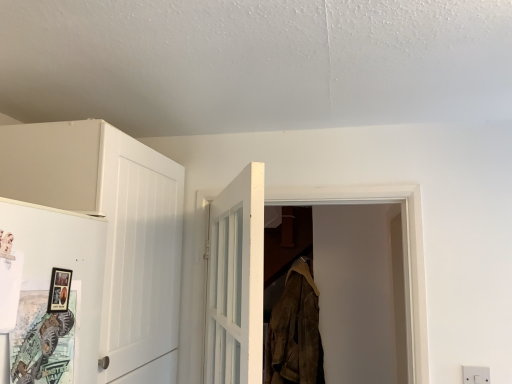
What do you see at coordinates (295, 331) in the screenshot? The width and height of the screenshot is (512, 384). I see `brown suede jacket at center` at bounding box center [295, 331].

What do you see at coordinates (476, 375) in the screenshot?
I see `white plastic electric outlet at lower right` at bounding box center [476, 375].

Find the location of `brown suede jacket at center`. brown suede jacket at center is located at coordinates (295, 331).

From the picture: Looking at their sizes, would you say white plastic electric outlet at lower right is wider or thinner than white wooden door at center, arranged as the 2th door when viewed from the front?

In the image, white plastic electric outlet at lower right appears to be more narrow than white wooden door at center, arranged as the 2th door when viewed from the front.

Which is less distant, (476, 380) or (230, 339)?

Positioned in front is point (230, 339).

Considering the relative sizes of white plastic electric outlet at lower right and white wooden door at center, arranged as the 2th door when viewed from the front, in the image provided, is white plastic electric outlet at lower right taller than white wooden door at center, arranged as the 2th door when viewed from the front,?

No.

From a real-world perspective, which object stands above the other?

matte white door at left, the 2th door when ordered from back to front.

From the image's perspective, is brown suede jacket at center positioned above or below matte white door at left, the second door in the right-to-left sequence?

brown suede jacket at center is below matte white door at left, the second door in the right-to-left sequence.

Considering the positions of objects brown suede jacket at center and matte white door at left, the 2th door when ordered from back to front, in the image provided, who is more to the left, brown suede jacket at center or matte white door at left, the 2th door when ordered from back to front,?

A: Positioned to the left is matte white door at left, the 2th door when ordered from back to front.

Where is `the 1st door directly above the brown suede jacket at center (from a real-world perspective)`? This screenshot has height=384, width=512. the 1st door directly above the brown suede jacket at center (from a real-world perspective) is located at coordinates (64, 262).

Considering the relative positions of white wooden door at center, positioned as the first door in back-to-front order, and white plastic electric outlet at lower right in the image provided, is white wooden door at center, positioned as the first door in back-to-front order, to the right of white plastic electric outlet at lower right from the viewer's perspective?

In fact, white wooden door at center, positioned as the first door in back-to-front order, is to the left of white plastic electric outlet at lower right.

From the image's perspective, between white wooden door at center, the second door when ordered from left to right, and white plastic electric outlet at lower right, who is located below?

From the image's view, white plastic electric outlet at lower right is below.

From a real-world perspective, is white wooden door at center, the 1th door from the right, on top of white plastic electric outlet at lower right?

Correct, in the physical world, white wooden door at center, the 1th door from the right, is higher than white plastic electric outlet at lower right.

Looking at their sizes, would you say white wooden door at center, positioned as the first door in back-to-front order, is wider or thinner than white plastic electric outlet at lower right?

Considering their sizes, white wooden door at center, positioned as the first door in back-to-front order, looks broader than white plastic electric outlet at lower right.

Is white matte cabinet at left further to the viewer compared to matte black picture frame at left?

Yes, white matte cabinet at left is further from the camera.

Is matte black picture frame at left inside white matte cabinet at left?

That's incorrect, matte black picture frame at left is not inside white matte cabinet at left.

Who is taller, white matte cabinet at left or matte black picture frame at left?

white matte cabinet at left.

How different are the orientations of white matte cabinet at left and matte black picture frame at left in degrees?

The facing directions of white matte cabinet at left and matte black picture frame at left are 0.0297 degrees apart.

Is matte white door at left, the first door positioned from the left, far from white plastic electric outlet at lower right?

Yes, matte white door at left, the first door positioned from the left, is far from white plastic electric outlet at lower right.

Is matte white door at left, acting as the 1th door starting from the front, aimed at white plastic electric outlet at lower right?

No, matte white door at left, acting as the 1th door starting from the front, is not oriented towards white plastic electric outlet at lower right.

Is white plastic electric outlet at lower right a part of matte white door at left, acting as the 1th door starting from the front?

No, white plastic electric outlet at lower right is not surrounded by matte white door at left, acting as the 1th door starting from the front.

Is matte white door at left, the 2th door when ordered from back to front, shorter than white plastic electric outlet at lower right?

Incorrect, the height of matte white door at left, the 2th door when ordered from back to front, does not fall short of that of white plastic electric outlet at lower right.

Between white plastic electric outlet at lower right and matte black picture frame at left, which one has less height?

With less height is white plastic electric outlet at lower right.

Is matte black picture frame at left a part of white plastic electric outlet at lower right?

Actually, matte black picture frame at left is outside white plastic electric outlet at lower right.

Between white plastic electric outlet at lower right and matte black picture frame at left, which one has smaller size?

Smaller between the two is matte black picture frame at left.

Is the depth of white plastic electric outlet at lower right less than that of matte black picture frame at left?

No, white plastic electric outlet at lower right is further to the viewer.

Is matte black picture frame at left smaller than white wooden door at center, the second door when ordered from left to right?

Yes.

I want to click on picture frame on the left of white wooden door at center, arranged as the 2th door when viewed from the front, so click(x=59, y=290).

Does matte black picture frame at left have a greater width compared to white wooden door at center, positioned as the first door in back-to-front order?

In fact, matte black picture frame at left might be narrower than white wooden door at center, positioned as the first door in back-to-front order.

Which is in front, point (62, 269) or point (231, 320)?

The point (62, 269) is closer to the camera.

The width and height of the screenshot is (512, 384). Identify the location of the 1st door above the white plastic electric outlet at lower right (from the image's perspective). (236, 281).

Locate an element on the screen. Image resolution: width=512 pixels, height=384 pixels. clothing that appears below the matte white door at left, the first door positioned from the left (from a real-world perspective) is located at coordinates (295, 331).

Estimate the real-world distances between objects in this image. Which object is further from matte white door at left, the first door positioned from the left, matte black picture frame at left or brown suede jacket at center?

brown suede jacket at center is positioned further to the anchor matte white door at left, the first door positioned from the left.

When comparing their distances from white matte cabinet at left, does matte white door at left, the second door in the right-to-left sequence, or matte black picture frame at left seem closer?

matte white door at left, the second door in the right-to-left sequence.

Which object lies further to the anchor point white matte cabinet at left, matte white door at left, the second door in the right-to-left sequence, or white plastic electric outlet at lower right?

Based on the image, white plastic electric outlet at lower right appears to be further to white matte cabinet at left.

Which object lies further to the anchor point white wooden door at center, positioned as the first door in back-to-front order, white matte cabinet at left or brown suede jacket at center?

brown suede jacket at center lies further to white wooden door at center, positioned as the first door in back-to-front order, than the other object.

Consider the image. When comparing their distances from matte black picture frame at left, does brown suede jacket at center or matte white door at left, the second door in the right-to-left sequence, seem further?

Based on the image, brown suede jacket at center appears to be further to matte black picture frame at left.

From the image, which object appears to be farther from matte white door at left, acting as the 1th door starting from the front, brown suede jacket at center or white plastic electric outlet at lower right?

brown suede jacket at center is positioned further to the anchor matte white door at left, acting as the 1th door starting from the front.

Based on their spatial positions, is white wooden door at center, the 1th door from the right, or matte black picture frame at left further from white matte cabinet at left?

The object further to white matte cabinet at left is matte black picture frame at left.

Looking at the image, which one is located closer to white plastic electric outlet at lower right, matte black picture frame at left or brown suede jacket at center?

The object closer to white plastic electric outlet at lower right is brown suede jacket at center.

Where is `picture frame between matte white door at left, acting as the 1th door starting from the front, and white matte cabinet at left from front to back`? picture frame between matte white door at left, acting as the 1th door starting from the front, and white matte cabinet at left from front to back is located at coordinates (59, 290).

This screenshot has width=512, height=384. Identify the location of door situated between matte black picture frame at left and white wooden door at center, the second door when ordered from left to right, from left to right. (64, 262).

This screenshot has height=384, width=512. What are the coordinates of `door situated between matte white door at left, the first door positioned from the left, and white plastic electric outlet at lower right from left to right` in the screenshot? It's located at (236, 281).

Where is `picture frame located between white wooden door at center, the second door when ordered from left to right, and brown suede jacket at center in the depth direction`? The width and height of the screenshot is (512, 384). picture frame located between white wooden door at center, the second door when ordered from left to right, and brown suede jacket at center in the depth direction is located at coordinates (59, 290).